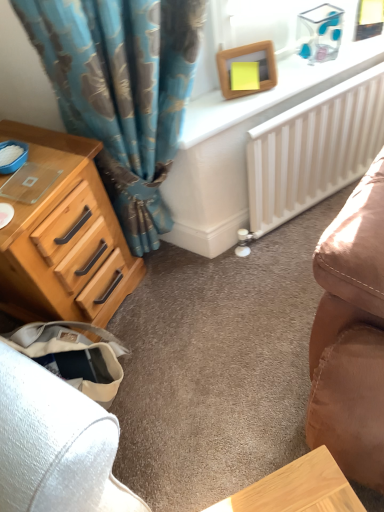
The height and width of the screenshot is (512, 384). I want to click on light brown wood chest of drawers at left, so click(x=61, y=234).

Based on the photo, based on their sizes in the image, would you say wooden picture frame at upper center is bigger or smaller than light brown wood chest of drawers at left?

A: In the image, wooden picture frame at upper center appears to be smaller than light brown wood chest of drawers at left.

Is wooden picture frame at upper center positioned with its back to light brown wood chest of drawers at left?

No.

Is wooden picture frame at upper center positioned before light brown wood chest of drawers at left?

No, the depth of wooden picture frame at upper center is greater than that of light brown wood chest of drawers at left.

In terms of width, does wooden picture frame at upper center look wider or thinner when compared to light brown wood chest of drawers at left?

In the image, wooden picture frame at upper center appears to be more narrow than light brown wood chest of drawers at left.

Is white matte radiator at center-right facing towards white glossy radiator at upper center?

Yes.

From the image's perspective, which object appears higher, white matte radiator at center-right or white glossy radiator at upper center?

white glossy radiator at upper center, from the image's perspective.

Between white matte radiator at center-right and white glossy radiator at upper center, which one has larger width?

With larger width is white glossy radiator at upper center.

In the scene shown: Could you tell me if white glossy radiator at upper center is facing wooden picture frame at upper center?

No, white glossy radiator at upper center is not facing towards wooden picture frame at upper center.

What's the angular difference between white glossy radiator at upper center and wooden picture frame at upper center's facing directions?

white glossy radiator at upper center and wooden picture frame at upper center are facing 21.5 degrees away from each other.

Between white glossy radiator at upper center and wooden picture frame at upper center, which one appears on the left side from the viewer's perspective?

Positioned to the left is wooden picture frame at upper center.

From a real-world perspective, relative to wooden picture frame at upper center, is white glossy radiator at upper center vertically above or below?

white glossy radiator at upper center is situated lower than wooden picture frame at upper center in the real world.

Would you say white matte radiator at center-right contains wooden picture frame at upper center?

No, wooden picture frame at upper center is not a part of white matte radiator at center-right.

Which is closer, [322,197] or [259,60]?

Point [322,197].

Considering the relative positions of white matte radiator at center-right and wooden picture frame at upper center in the image provided, is white matte radiator at center-right behind wooden picture frame at upper center?

Yes.

How different are the orientations of light brown wood chest of drawers at left and white glossy radiator at upper center in degrees?

They differ by 29.6 degrees in their facing directions.

Where is `the chest of drawers lying below the white glossy radiator at upper center (from the image's perspective)`? This screenshot has width=384, height=512. the chest of drawers lying below the white glossy radiator at upper center (from the image's perspective) is located at coordinates (61, 234).

Considering the relative positions of light brown wood chest of drawers at left and white glossy radiator at upper center in the image provided, is light brown wood chest of drawers at left to the right of white glossy radiator at upper center from the viewer's perspective?

No, light brown wood chest of drawers at left is not to the right of white glossy radiator at upper center.

Does point (64, 276) lie behind point (361, 53)?

That is False.

From the image's perspective, which is below, white glossy radiator at upper center or white matte radiator at center-right?

white matte radiator at center-right appears lower in the image.

From a real-world perspective, who is located lower, white glossy radiator at upper center or white matte radiator at center-right?

In real-world perspective, white matte radiator at center-right is lower.

Who is smaller, white glossy radiator at upper center or white matte radiator at center-right?

With smaller size is white matte radiator at center-right.

In terms of width, does white glossy radiator at upper center look wider or thinner when compared to white matte radiator at center-right?

Clearly, white glossy radiator at upper center has more width compared to white matte radiator at center-right.

In the scene shown: Which object is further away from the camera, white glossy radiator at upper center or light brown wood chest of drawers at left?

white glossy radiator at upper center is more distant.

From a real-world perspective, between white glossy radiator at upper center and light brown wood chest of drawers at left, who is vertically lower?

In real-world perspective, white glossy radiator at upper center is lower.

From the image's perspective, is white glossy radiator at upper center on light brown wood chest of drawers at left?

Yes.

Find the location of `chest of drawers on the left of the wooden picture frame at upper center`. chest of drawers on the left of the wooden picture frame at upper center is located at coordinates (61, 234).

This screenshot has height=512, width=384. Find the location of `radiator lying on the right of white glossy radiator at upper center`. radiator lying on the right of white glossy radiator at upper center is located at coordinates (314, 149).

Consider the image. Considering their positions, is light brown wood chest of drawers at left positioned further to wooden picture frame at upper center than white matte radiator at center-right?

light brown wood chest of drawers at left is further to wooden picture frame at upper center.

Considering their positions, is light brown wood chest of drawers at left positioned closer to white glossy radiator at upper center than wooden picture frame at upper center?

wooden picture frame at upper center is positioned closer to the anchor white glossy radiator at upper center.

Estimate the real-world distances between objects in this image. Which object is further from light brown wood chest of drawers at left, white glossy radiator at upper center or wooden picture frame at upper center?

wooden picture frame at upper center lies further to light brown wood chest of drawers at left than the other object.

Based on their spatial positions, is light brown wood chest of drawers at left or white glossy radiator at upper center further from wooden picture frame at upper center?

Based on the image, light brown wood chest of drawers at left appears to be further to wooden picture frame at upper center.

From the image, which object appears to be farther from white matte radiator at center-right, white glossy radiator at upper center or wooden picture frame at upper center?

wooden picture frame at upper center lies further to white matte radiator at center-right than the other object.

Based on their spatial positions, is white matte radiator at center-right or wooden picture frame at upper center closer to light brown wood chest of drawers at left?

wooden picture frame at upper center is closer to light brown wood chest of drawers at left.

Based on the photo, from the image, which object appears to be farther from white glossy radiator at upper center, wooden picture frame at upper center or white matte radiator at center-right?

Based on the image, wooden picture frame at upper center appears to be further to white glossy radiator at upper center.

Based on their spatial positions, is white glossy radiator at upper center or light brown wood chest of drawers at left closer to wooden picture frame at upper center?

white glossy radiator at upper center.

Locate an element on the screen. computer desk between wooden picture frame at upper center and white matte radiator at center-right from left to right is located at coordinates (240, 147).

Locate an element on the screen. picture frame between light brown wood chest of drawers at left and white matte radiator at center-right from left to right is located at coordinates (247, 61).

In order to click on computer desk between light brown wood chest of drawers at left and white matte radiator at center-right in this screenshot , I will do `click(240, 147)`.

The image size is (384, 512). I want to click on picture frame situated between light brown wood chest of drawers at left and white glossy radiator at upper center from left to right, so click(247, 61).